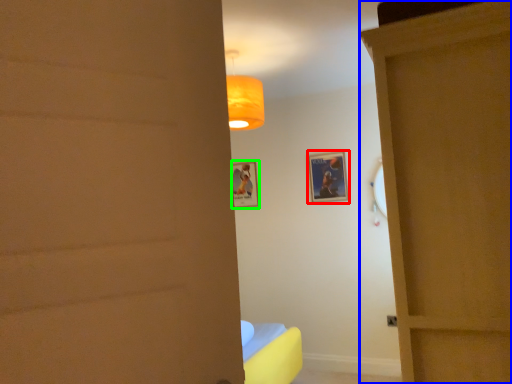
Question: Which object is positioned farthest from picture frame (highlighted by a red box)? Select from door (highlighted by a blue box) and picture frame (highlighted by a green box).

Choices:
 (A) door
 (B) picture frame

Answer: (A)